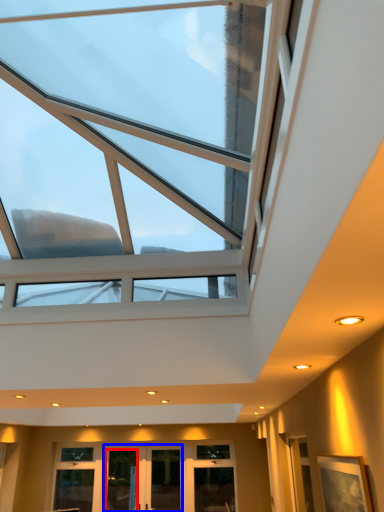
Question: Which object is closer to the camera taking this photo, glass door (highlighted by a red box) or glass door (highlighted by a blue box)?

Choices:
 (A) glass door
 (B) glass door

Answer: (B)